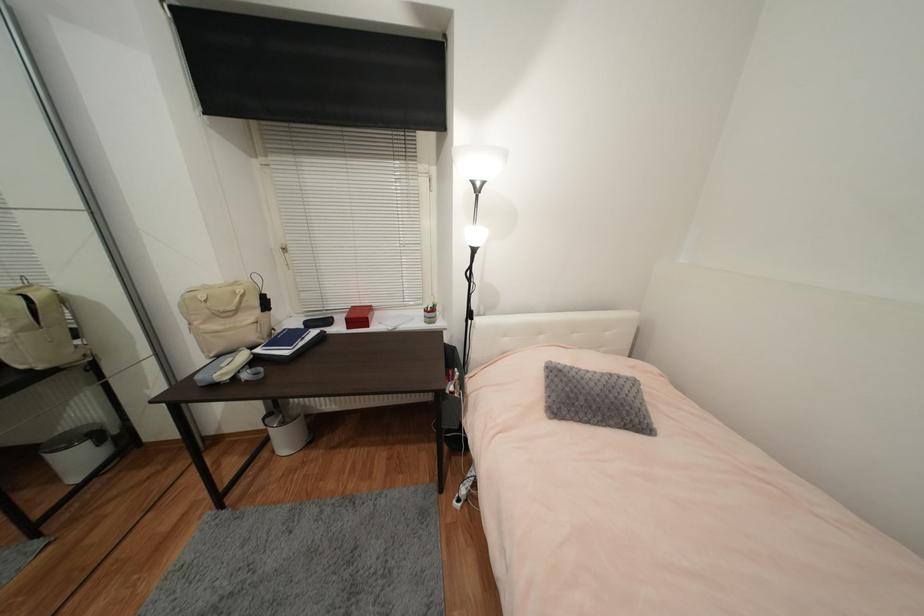
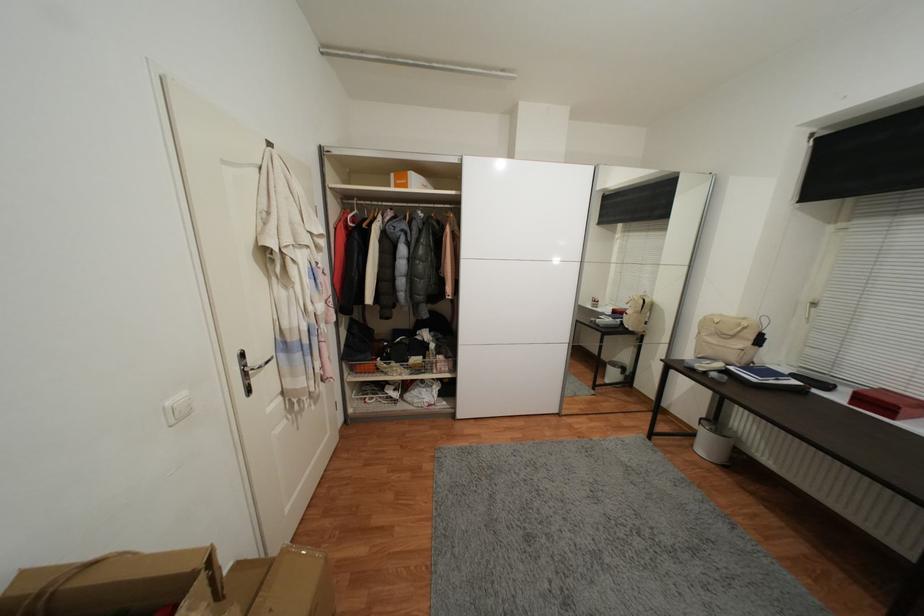
Locate, in the second image, the point that corresponds to the point at 277,453 in the first image.

(697, 447)